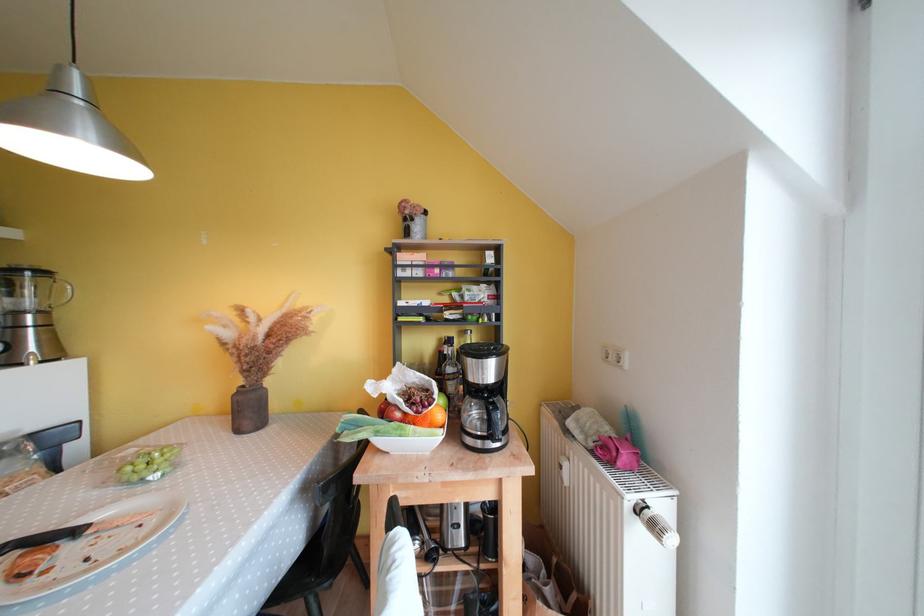
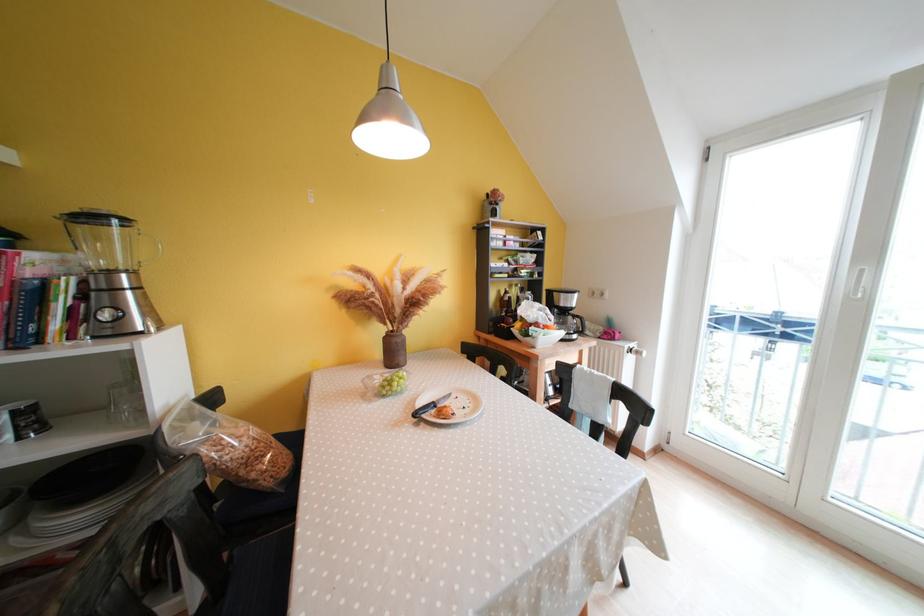
Question: Which direction would the cameraman need to move to produce the second image? Reply with the corresponding letter.

Choices:
 (A) Left
 (B) Right
 (C) Forward
 (D) Backward

Answer: (A)